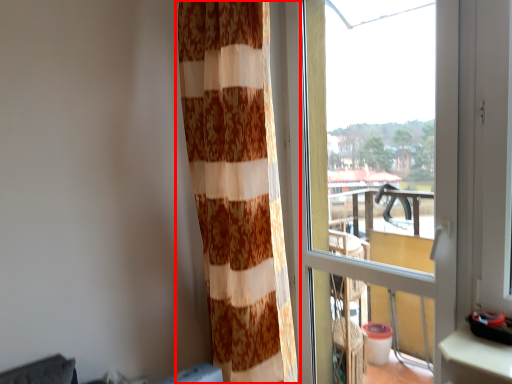
Question: Considering the relative positions of curtain (annotated by the red box) and window in the image provided, where is curtain (annotated by the red box) located with respect to the staircase?

Choices:
 (A) right
 (B) left

Answer: (B)